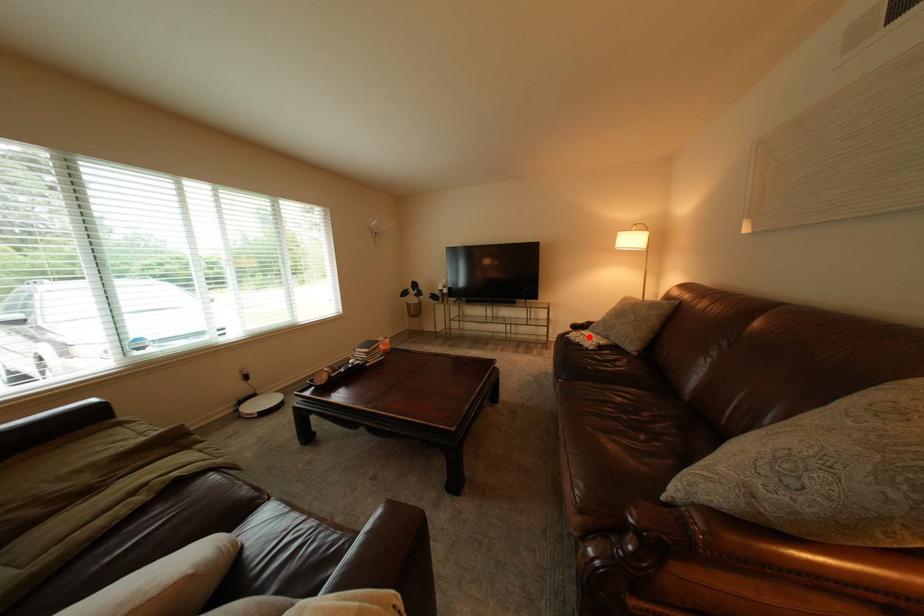
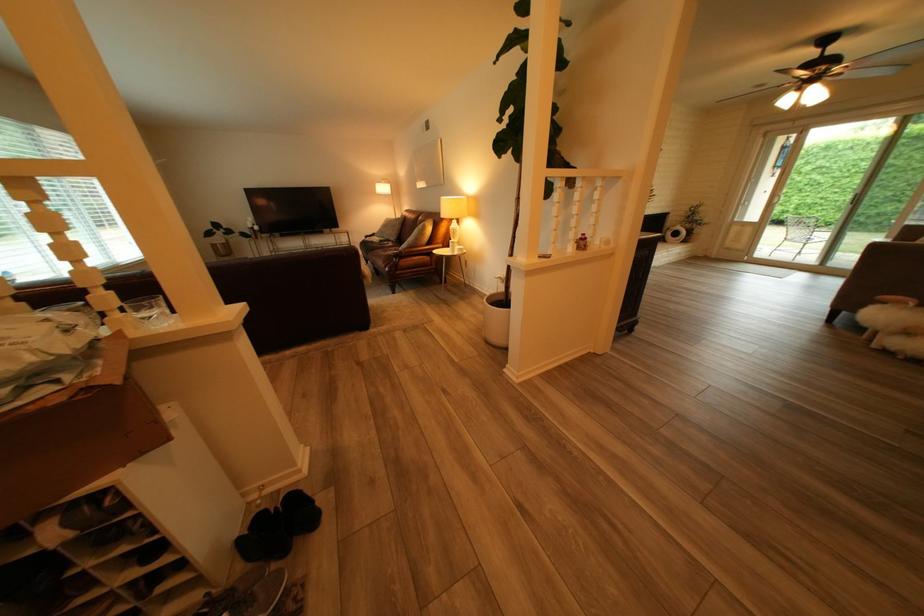
In the second image, find the point that corresponds to the highlighted location in the first image.

(383, 240)